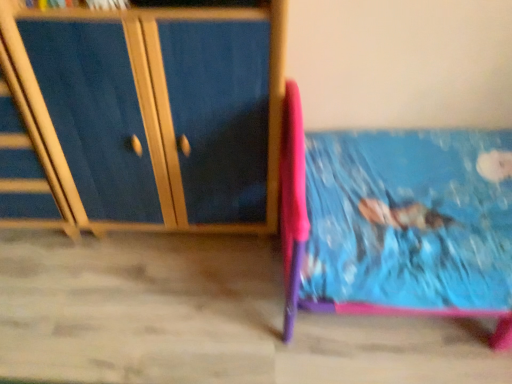
Where is `space that is in front of wooden drawer at left`? The image size is (512, 384). space that is in front of wooden drawer at left is located at coordinates (46, 284).